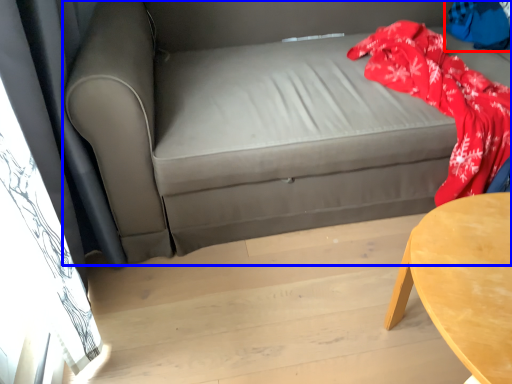
Question: Among these objects, which one is nearest to the camera, clothing (highlighted by a red box) or studio couch (highlighted by a blue box)?

Choices:
 (A) clothing
 (B) studio couch

Answer: (B)